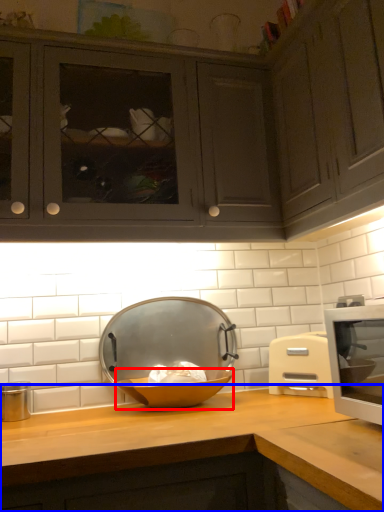
Question: Among these objects, which one is nearest to the camera, bowl (highlighted by a red box) or countertop (highlighted by a blue box)?

Choices:
 (A) bowl
 (B) countertop

Answer: (B)